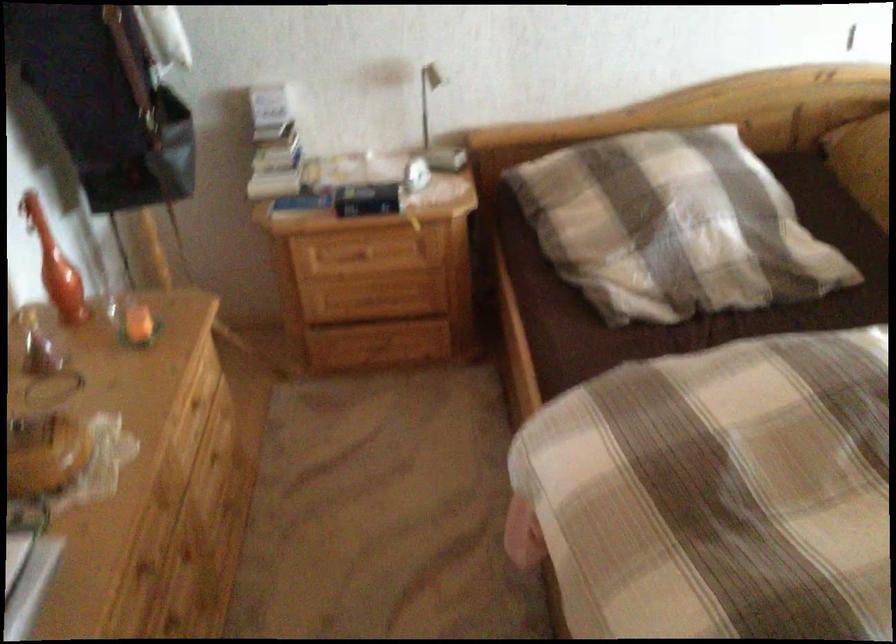
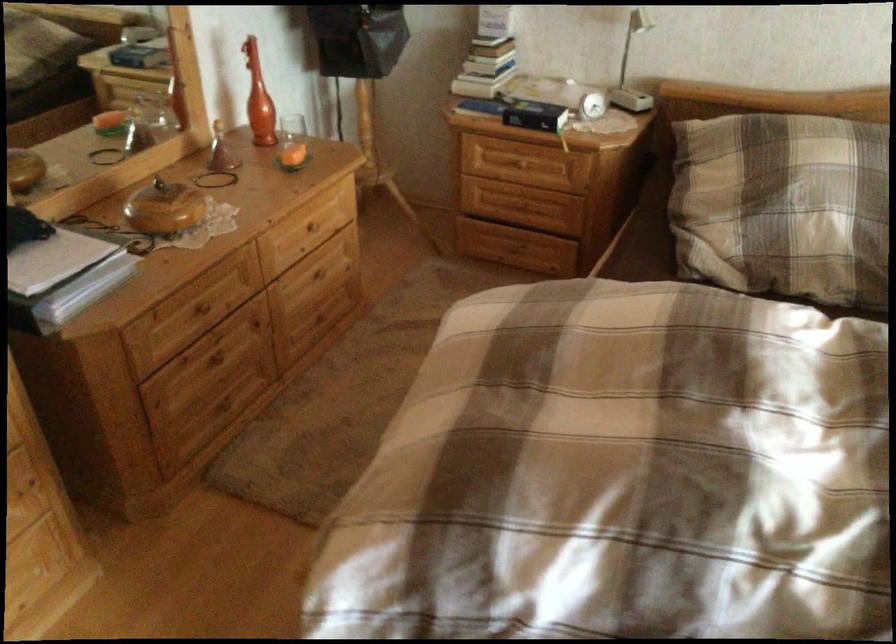
Question: The camera is either moving clockwise (left) or counter-clockwise (right) around the object. The first image is from the beginning of the video and the second image is from the end. Is the camera moving left or right when shooting the video?

Choices:
 (A) Left
 (B) Right

Answer: (B)